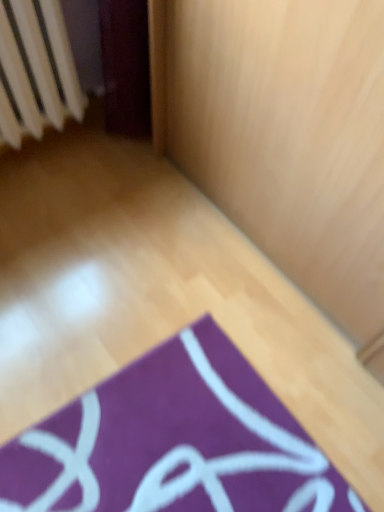
You are a GUI agent. You are given a task and a screenshot of the screen. Output one action in this format:
    pyautogui.click(x=<x>, y=<y>)
    Task: Click on the vacant space behind purple fabric yoga mat at lower center
    Image resolution: width=384 pixels, height=512 pixels.
    Given the screenshot: What is the action you would take?
    pyautogui.click(x=167, y=284)